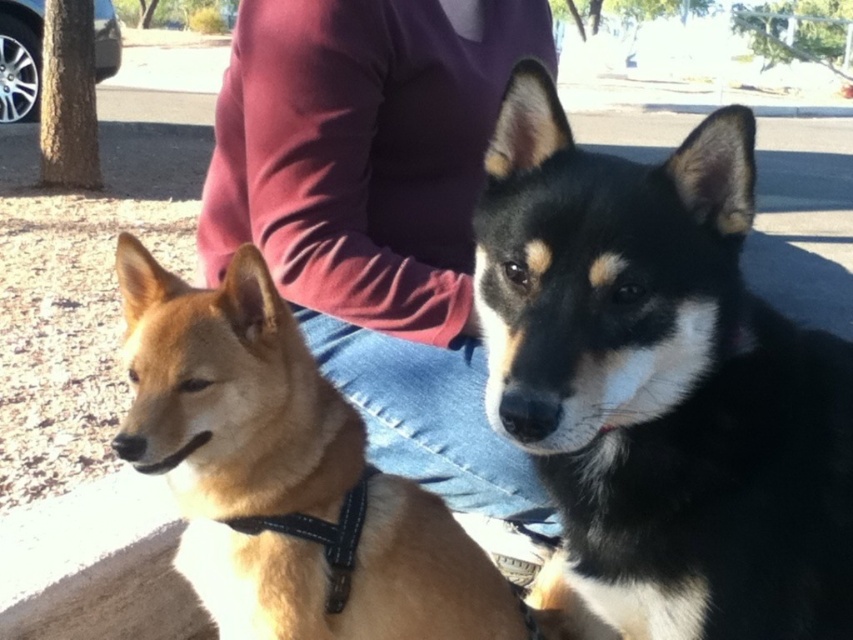
You are standing in the park and see two points marked in the image. Which point is nearer to you, point (601, 605) or point (466, 12)?

Point (601, 605) is closer to the viewer than point (466, 12).

Looking at this image, you are a photographer trying to capture a photo of the black fur dog at center and the golden fur dog at center. Since you want to ensure both dogs are fully visible in the frame, would the current positioning allow you to see the entire body of both dogs without any obstruction?

The black fur dog at center is positioned over golden fur dog at center, so the golden fur dog at center might be partially obscured by the black fur dog at center. Adjust their positions to ensure both are fully visible.

You are a photographer standing at the origin point of this scene. You want to take a photo of the black fur dog at center. What are the coordinates where you should aim your camera?

The coordinates to aim your camera are at point (x=662, y=381) to capture the black fur dog at center.